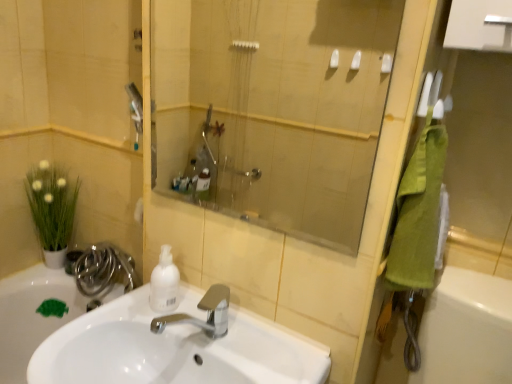
At what (x,y) coordinates should I click in order to perform the action: click on vacant area situated to the left side of white matte bottle at center. Please return your answer as a coordinate pair (x, y). The width and height of the screenshot is (512, 384). Looking at the image, I should click on (113, 317).